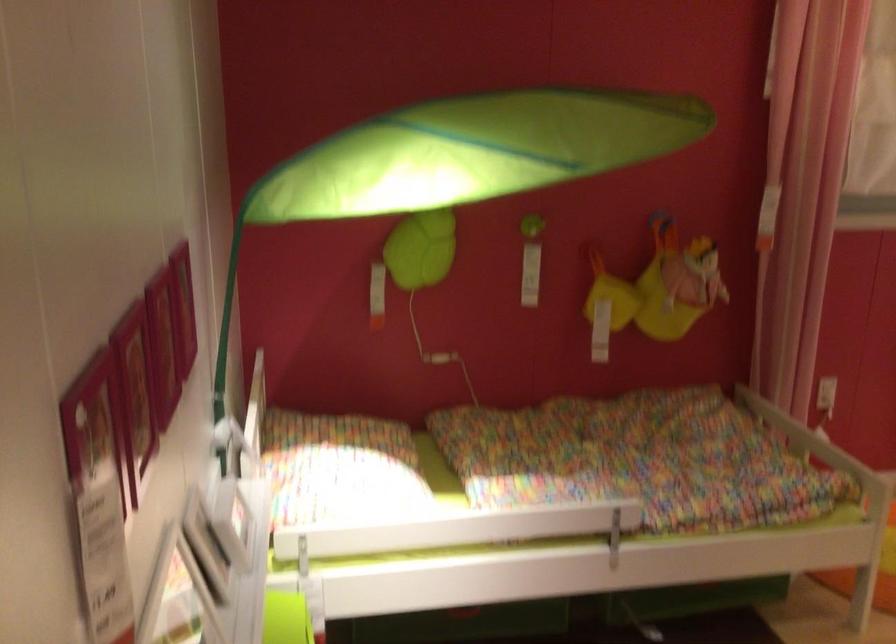
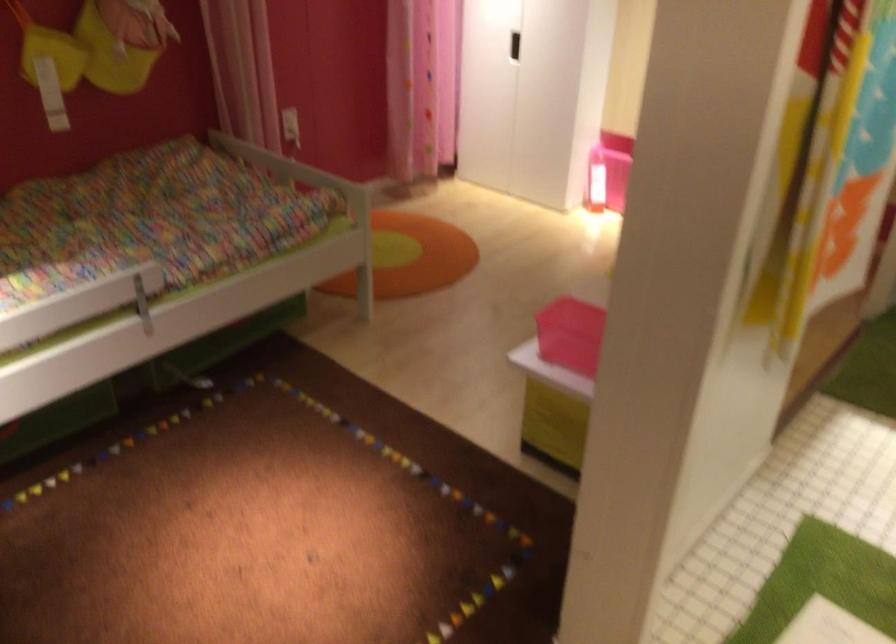
How did the camera likely rotate?

The camera rotated toward right-down.